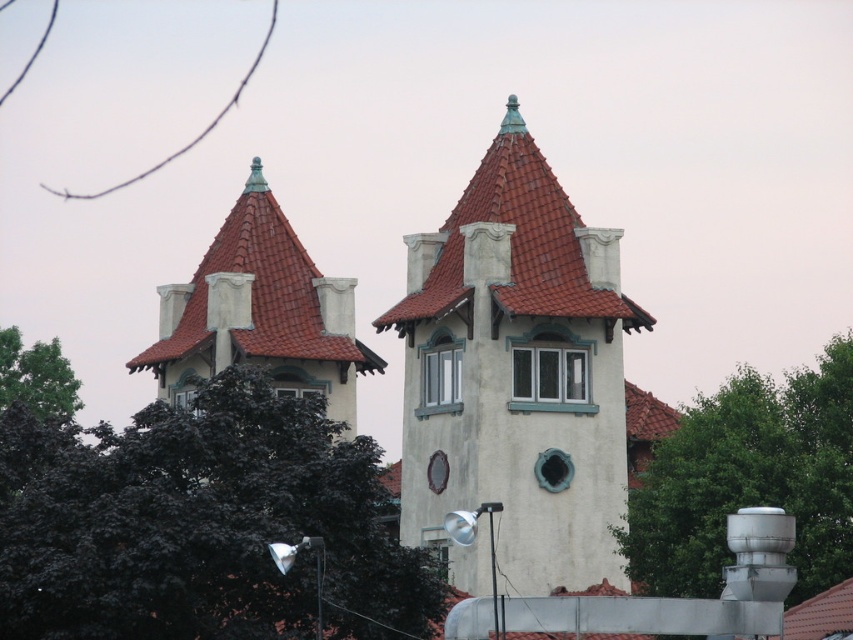
Question: Does dark green leaves at upper left appear under white plastic window at center?

Choices:
 (A) yes
 (B) no

Answer: (A)

Question: Estimate the real-world distances between objects in this image. Which object is farther from the white painted wood window at center?

Choices:
 (A) matte white tower at upper left
 (B) dark green leaves at upper left
 (C) white plastic window at center
 (D) green leafy tree at left

Answer: (D)

Question: Which of the following is the farthest from the observer?

Choices:
 (A) (749, 387)
 (B) (252, 340)
 (C) (59, 387)

Answer: (C)

Question: Which of the following is the farthest from the observer?

Choices:
 (A) (520, 403)
 (B) (564, 243)
 (C) (264, 211)
 (D) (97, 449)

Answer: (C)

Question: Is green leafy tree at center behind white painted wood window at center?

Choices:
 (A) no
 (B) yes

Answer: (A)

Question: Is dark green leaves at upper left to the right of clear glass window at upper center from the viewer's perspective?

Choices:
 (A) yes
 (B) no

Answer: (B)